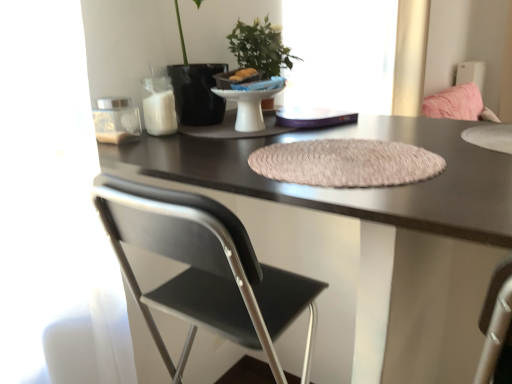
This screenshot has height=384, width=512. Identify the location of vacant space underneath beige textured placemat at center (from a real-world perspective). (356, 157).